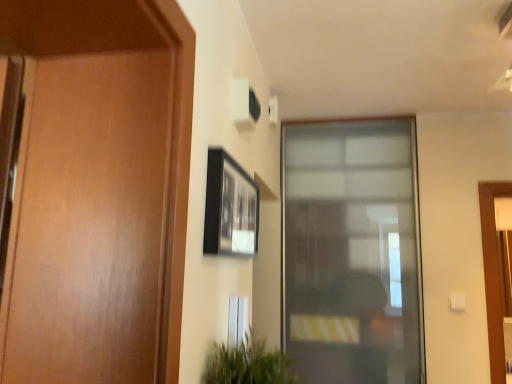
The image size is (512, 384). What do you see at coordinates (352, 251) in the screenshot?
I see `transparent glass window at center` at bounding box center [352, 251].

Identify the location of green leafy plant at lower center. (247, 364).

Does green leafy plant at lower center have a larger size compared to black matte picture frame at upper center?

Indeed, green leafy plant at lower center has a larger size compared to black matte picture frame at upper center.

In the scene shown: From a real-world perspective, which is physically below, green leafy plant at lower center or black matte picture frame at upper center?

From a 3D spatial view, green leafy plant at lower center is below.

Image resolution: width=512 pixels, height=384 pixels. In order to click on houseplant beneath the black matte picture frame at upper center (from a real-world perspective) in this screenshot , I will do `click(247, 364)`.

Looking at this image, is green leafy plant at lower center next to black matte picture frame at upper center and touching it?

green leafy plant at lower center is not next to black matte picture frame at upper center, and they're not touching.

Locate an element on the screen. This screenshot has height=384, width=512. window behind the green leafy plant at lower center is located at coordinates (352, 251).

From a real-world perspective, is transparent glass window at center beneath green leafy plant at lower center?

No, from a real-world perspective, transparent glass window at center is not beneath green leafy plant at lower center.

Considering the relative sizes of transparent glass window at center and green leafy plant at lower center in the image provided, is transparent glass window at center wider than green leafy plant at lower center?

No.

Considering the points (293, 295) and (220, 374), which point is behind, point (293, 295) or point (220, 374)?

The point (293, 295) is farther.

Consider the image. Would you consider transparent glass window at center to be distant from black matte picture frame at upper center?

Yes, transparent glass window at center is far from black matte picture frame at upper center.

From a real-world perspective, who is located higher, transparent glass window at center or black matte picture frame at upper center?

In real-world perspective, black matte picture frame at upper center is above.

Between transparent glass window at center and black matte picture frame at upper center, which one has less height?

Standing shorter between the two is black matte picture frame at upper center.

Where is `houseplant below the transparent glass window at center (from the image's perspective)`? houseplant below the transparent glass window at center (from the image's perspective) is located at coordinates (247, 364).

From a real-world perspective, is green leafy plant at lower center above or below transparent glass window at center?

green leafy plant at lower center is situated lower than transparent glass window at center in the real world.

Choose the correct answer: Is green leafy plant at lower center inside transparent glass window at center or outside it?

green leafy plant at lower center is spatially situated outside transparent glass window at center.

Measure the distance from black matte picture frame at upper center to green leafy plant at lower center.

12.89 inches.

Is the depth of black matte picture frame at upper center less than that of green leafy plant at lower center?

No, black matte picture frame at upper center is further to the viewer.

At what (x,y) coordinates should I click in order to perform the action: click on houseplant that appears below the black matte picture frame at upper center (from a real-world perspective). Please return your answer as a coordinate pair (x, y). Looking at the image, I should click on (247, 364).

Can you tell me how much black matte picture frame at upper center and transparent glass window at center differ in facing direction?

black matte picture frame at upper center and transparent glass window at center are facing 90.1 degrees away from each other.

Could you tell me if black matte picture frame at upper center is facing transparent glass window at center?

No.

Is black matte picture frame at upper center located outside transparent glass window at center?

Yes, black matte picture frame at upper center is outside of transparent glass window at center.

In the image, is black matte picture frame at upper center on the left side or the right side of transparent glass window at center?

Clearly, black matte picture frame at upper center is on the left of transparent glass window at center in the image.

In the image, there is a black matte picture frame at upper center. Where is `houseplant below it (from a real-world perspective)`? houseplant below it (from a real-world perspective) is located at coordinates (247, 364).

The width and height of the screenshot is (512, 384). I want to click on houseplant that appears below the transparent glass window at center (from the image's perspective), so click(247, 364).

When comparing their distances from transparent glass window at center, does green leafy plant at lower center or black matte picture frame at upper center seem further?

Based on the image, green leafy plant at lower center appears to be further to transparent glass window at center.

Estimate the real-world distances between objects in this image. Which object is further from black matte picture frame at upper center, green leafy plant at lower center or transparent glass window at center?

Among the two, transparent glass window at center is located further to black matte picture frame at upper center.

Looking at the image, which one is located closer to black matte picture frame at upper center, transparent glass window at center or green leafy plant at lower center?

Based on the image, green leafy plant at lower center appears to be nearer to black matte picture frame at upper center.

When comparing their distances from transparent glass window at center, does black matte picture frame at upper center or green leafy plant at lower center seem closer?

black matte picture frame at upper center lies closer to transparent glass window at center than the other object.

Which object lies nearer to the anchor point green leafy plant at lower center, black matte picture frame at upper center or transparent glass window at center?

Among the two, black matte picture frame at upper center is located nearer to green leafy plant at lower center.

Which object lies nearer to the anchor point green leafy plant at lower center, transparent glass window at center or black matte picture frame at upper center?

black matte picture frame at upper center lies closer to green leafy plant at lower center than the other object.

Image resolution: width=512 pixels, height=384 pixels. I want to click on picture frame between green leafy plant at lower center and transparent glass window at center from front to back, so (230, 208).